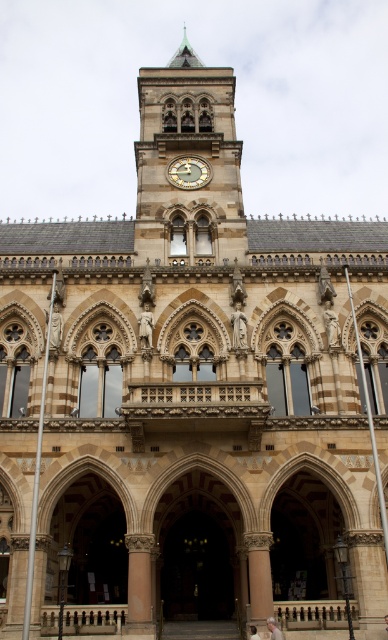
Who is positioned more to the left, wooden clock face at center or light brown wooden chair at lower center?

wooden clock face at center

Where is `wooden clock face at center`? This screenshot has height=640, width=388. wooden clock face at center is located at coordinates (188, 172).

Is golden polished clock tower at center further to camera compared to wooden clock face at center?

That is False.

Can you confirm if golden polished clock tower at center is shorter than wooden clock face at center?

In fact, golden polished clock tower at center may be taller than wooden clock face at center.

The height and width of the screenshot is (640, 388). I want to click on golden polished clock tower at center, so click(x=188, y=160).

Locate an element on the screen. golden polished clock tower at center is located at coordinates (188, 160).

Which is below, golden polished clock tower at center or light brown wooden chair at lower center?

light brown wooden chair at lower center is lower down.

Locate an element on the screen. The height and width of the screenshot is (640, 388). golden polished clock tower at center is located at coordinates (188, 160).

Image resolution: width=388 pixels, height=640 pixels. Identify the location of golden polished clock tower at center. (188, 160).